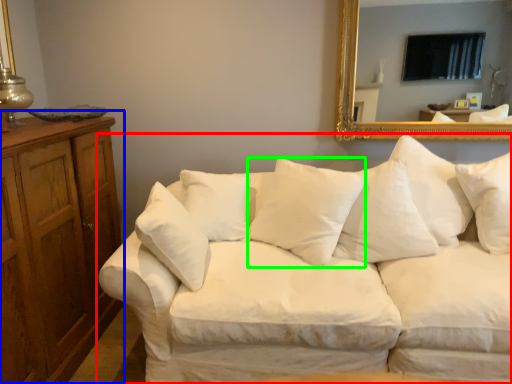
Question: Which is nearer to the studio couch (highlighted by a red box)? dresser (highlighted by a blue box) or pillow (highlighted by a green box).

Choices:
 (A) dresser
 (B) pillow

Answer: (B)